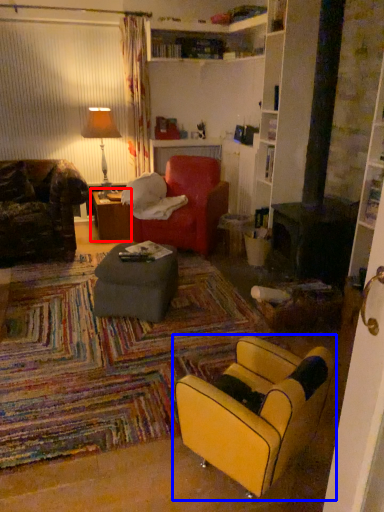
Question: Among these objects, which one is farthest to the camera, table (highlighted by a red box) or chair (highlighted by a blue box)?

Choices:
 (A) table
 (B) chair

Answer: (A)